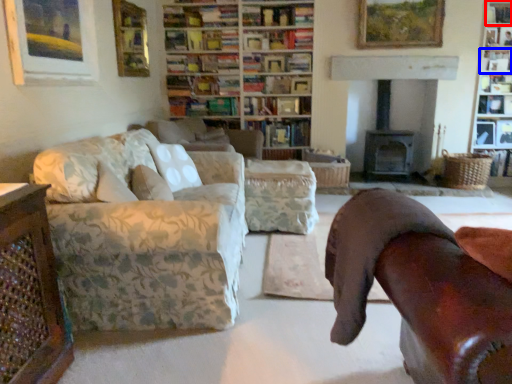
Question: Which object is closer to the camera taking this photo, shelf (highlighted by a red box) or shelf (highlighted by a blue box)?

Choices:
 (A) shelf
 (B) shelf

Answer: (A)